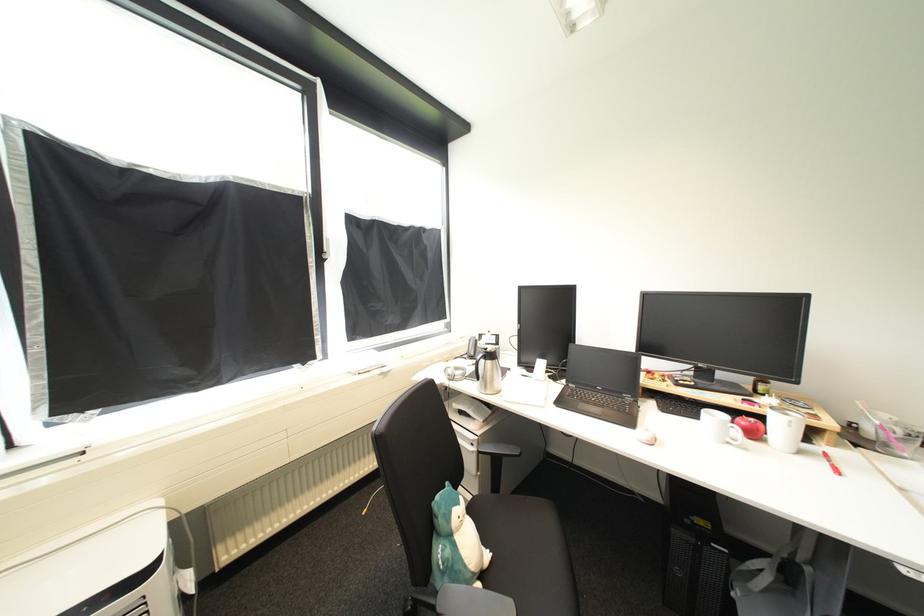
Find where to lift the telephone handset. Please return your answer as a coordinate pair (x, y).

(470, 347)